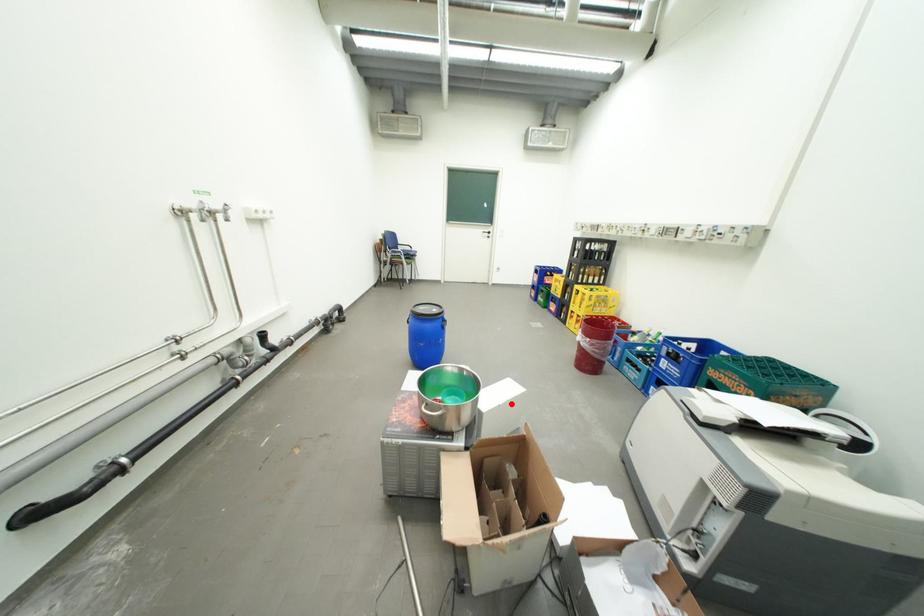
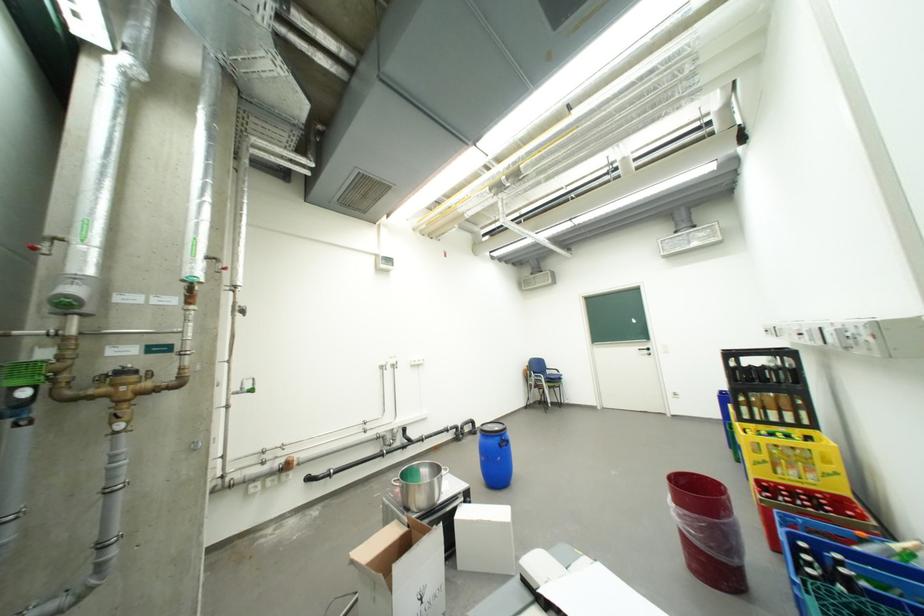
Find the pixel in the second image that matches the highlighted location in the first image.

(484, 520)